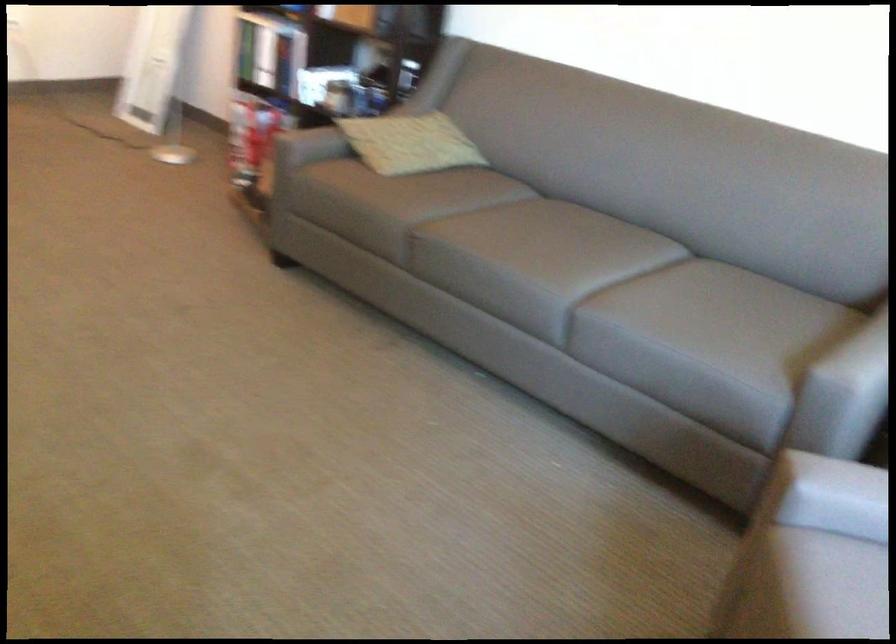
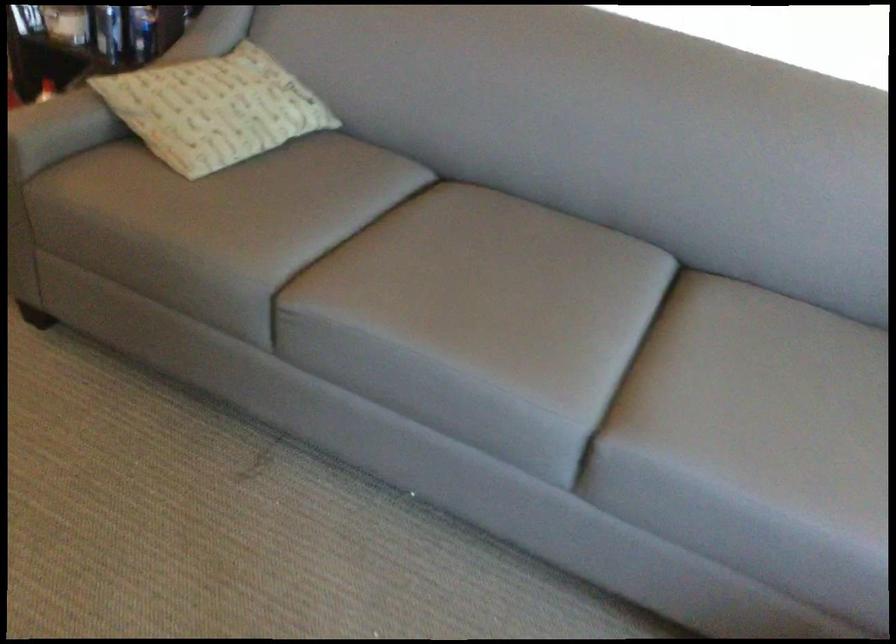
Question: The images are taken continuously from a first-person perspective. In which direction are you moving?

Choices:
 (A) Left
 (B) Right
 (C) Forward
 (D) Backward

Answer: (C)